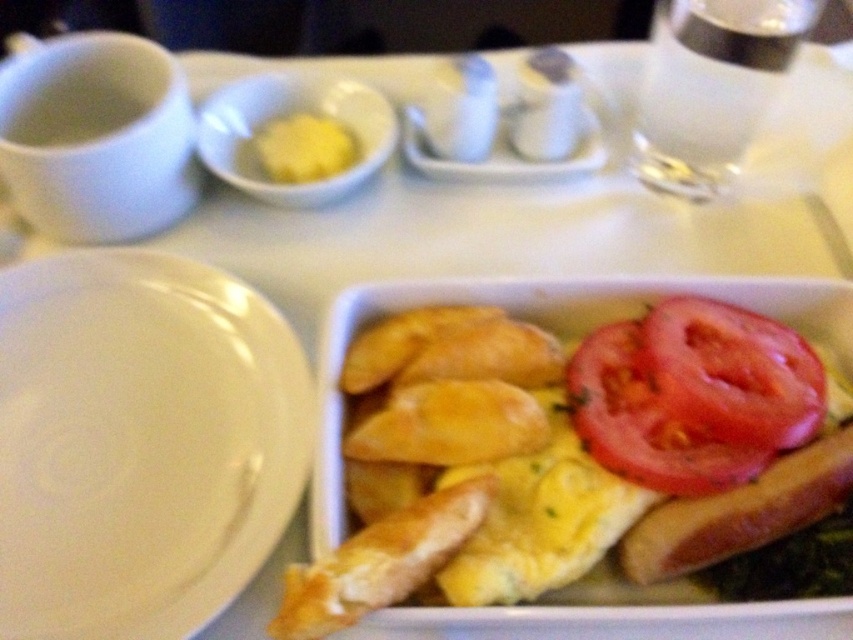
In the scene shown: You are setting up a table for a guest who requires a taller dish. You have a white glossy plate at center left and white glossy salt and pepper shakers at center. Which object is taller?

The white glossy plate at center left is much taller than the white glossy salt and pepper shakers at center, so the white glossy plate at center left is taller.

You are looking at the breakfast table and see two points marked on the image. The first point is at coordinate point(258, 440) and the second is at point(579, 170). Which point is closer to you?

Point(258, 440) is closer to the camera than point(579, 170).

You are standing 24 inches away from the table. There is a point labeled as point [763,392] on the table. Can you reach this point with your hand?

The point labeled as point [763,392] is 18.69 inches away from the camera. Since you are standing 24 inches away from the table, you can reach this point with your hand because it is closer than your standing distance.